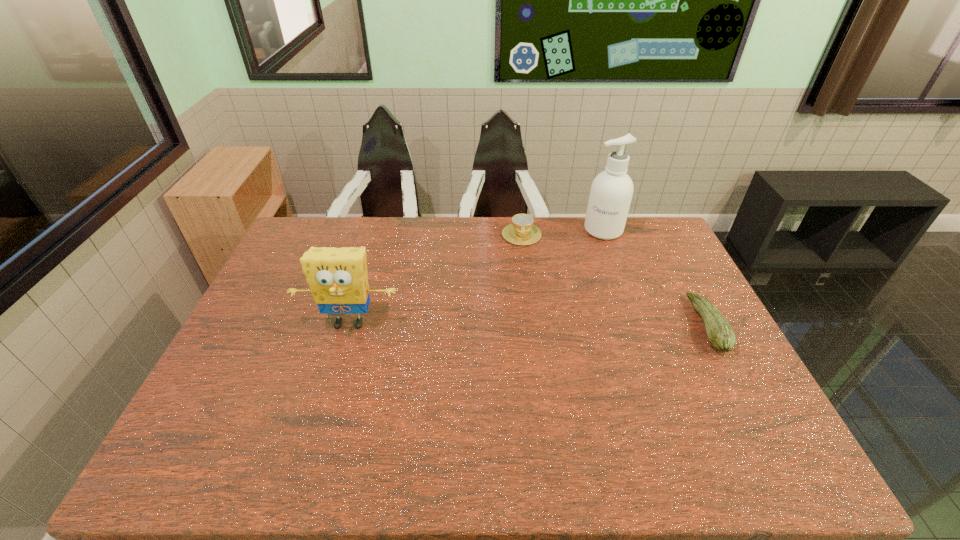
In order to click on vacant space on the desktop that is between the sponge and the rightmost object and is positioned with the handle on the side of the third object from right to left in this screenshot , I will do tap(524, 324).

Identify the location of vacant space on the desktop that is between the leftmost object and the rightmost object and is positioned on the front label of the cleansing agent. (569, 325).